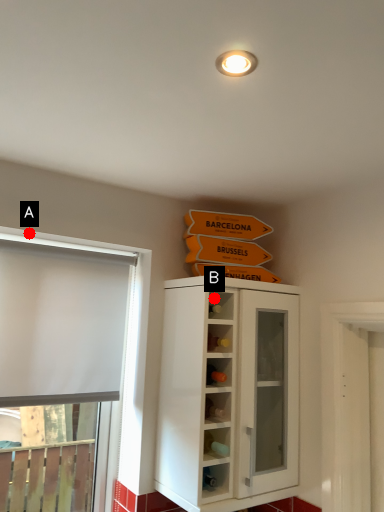
Question: Two points are circled on the image, labeled by A and B beside each circle. Which point is further to the camera?

Choices:
 (A) A is further
 (B) B is further

Answer: (B)